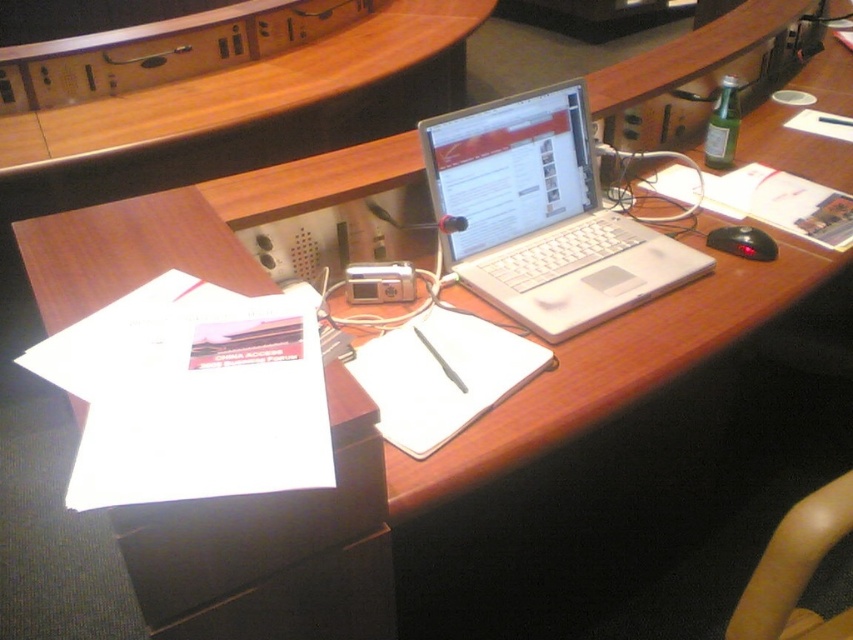
You are organizing a meeting and need to place a 12cm tall document holder on the desk. Considering the white paper at lower left and silver metallic laptop at center, which object can the document holder be placed next to without blocking the view of the other object?

The document holder can be placed next to the silver metallic laptop at center because the white paper at lower left is not as tall as the silver metallic laptop at center, so placing the document holder next to the taller laptop would avoid blocking the view of the shorter paper.